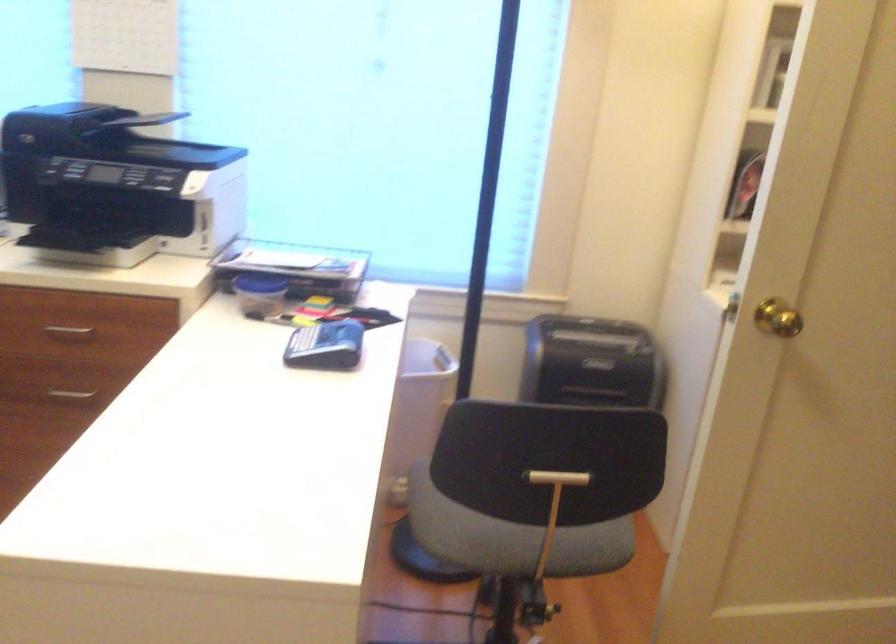
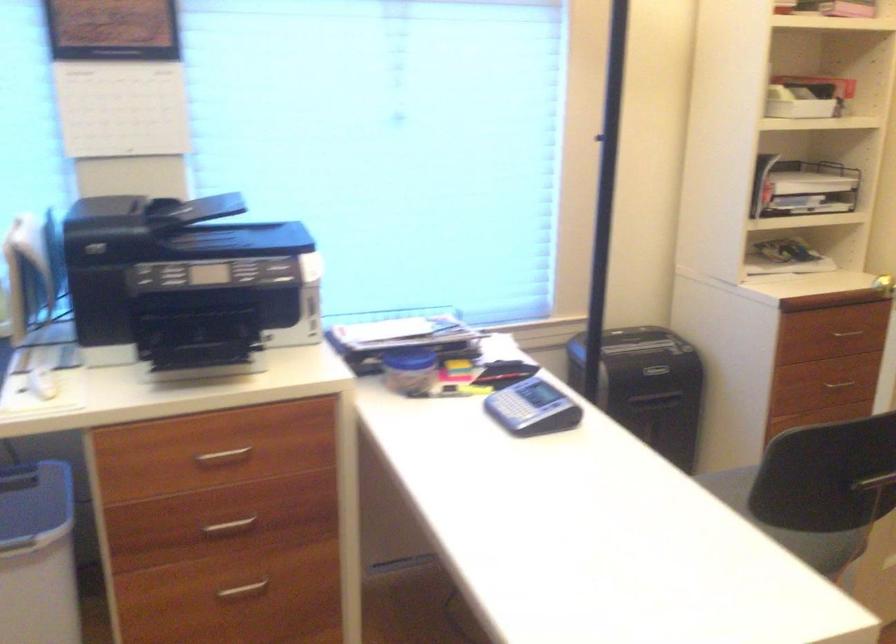
Question: How did the camera likely rotate?

Choices:
 (A) Left
 (B) Right
 (C) Up
 (D) Down

Answer: (B)